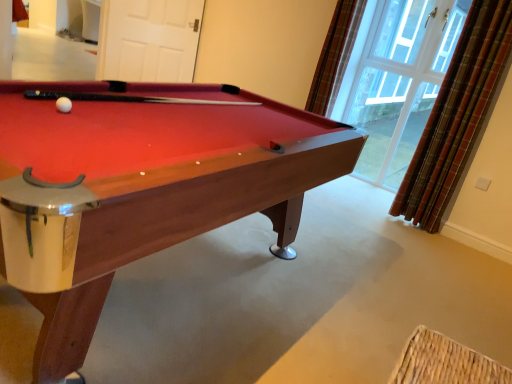
Question: In terms of size, does plaid fabric curtain at upper right, which ranks as the first curtain in left-to-right order, appear bigger or smaller than white matte door at upper center?

Choices:
 (A) big
 (B) small

Answer: (B)

Question: Considering the relative positions of plaid fabric curtain at upper right, which ranks as the first curtain in left-to-right order, and white matte door at upper center in the image provided, is plaid fabric curtain at upper right, which ranks as the first curtain in left-to-right order, to the left or to the right of white matte door at upper center?

Choices:
 (A) right
 (B) left

Answer: (A)

Question: Estimate the real-world distances between objects in this image. Which object is farther from the clear glass window at upper right?

Choices:
 (A) white matte door at upper center
 (B) white matte ball at upper left
 (C) plaid fabric curtain at upper right, which is the 2th curtain in right-to-left order
 (D) wooden billiard table at center
 (E) plaid fabric curtain at right, acting as the 1th curtain starting from the right

Answer: (B)

Question: Which object is the closest to the clear glass window at upper right?

Choices:
 (A) plaid fabric curtain at upper right, which is the 2th curtain in right-to-left order
 (B) white matte ball at upper left
 (C) wooden billiard table at center
 (D) white matte door at upper center
 (E) plaid fabric curtain at right, acting as the 1th curtain starting from the right

Answer: (A)